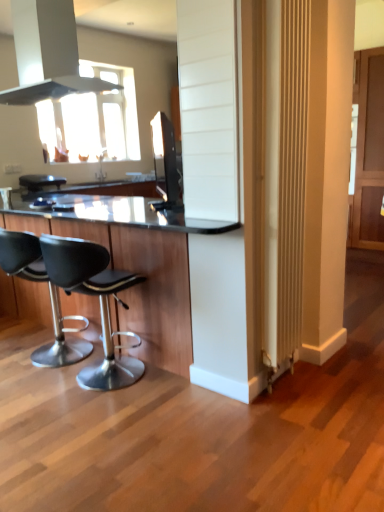
I want to click on free space underneath black leather stool at lower left, the 2th chair positioned from the right (from a real-world perspective), so click(x=32, y=366).